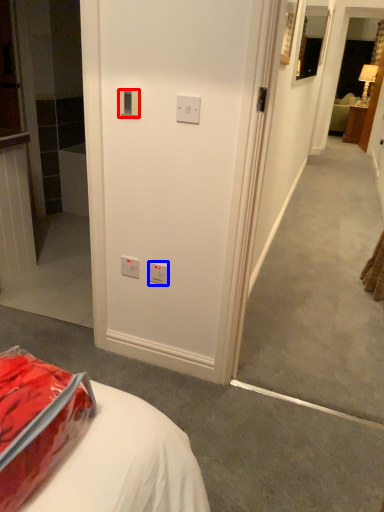
Question: Which point is further to the camera, electric outlet (highlighted by a red box) or electric outlet (highlighted by a blue box)?

Choices:
 (A) electric outlet
 (B) electric outlet

Answer: (B)